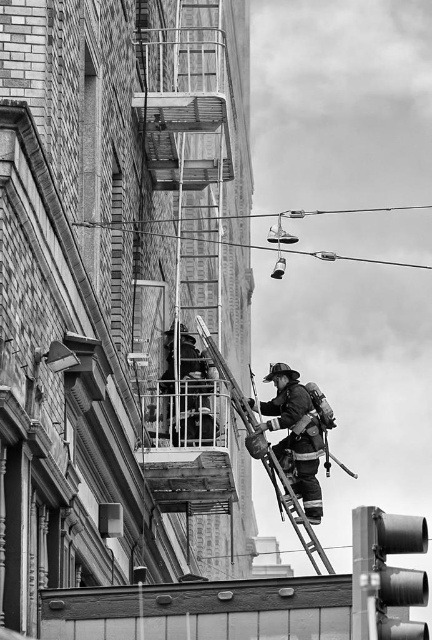
Is reflective silver helmet at center smaller than metallic silver ladder at center?

Yes.

Based on the photo, is reflective silver helmet at center behind metallic silver ladder at center?

Yes, reflective silver helmet at center is further from the viewer.

Between point (267, 376) and point (327, 561), which one is positioned behind?

Point (267, 376)

This screenshot has width=432, height=640. I want to click on reflective silver helmet at center, so click(x=298, y=433).

Is point (406, 604) closer to camera compared to point (384, 209)?

Yes.

This screenshot has width=432, height=640. What do you see at coordinates (400, 573) in the screenshot?
I see `metallic gray traffic light at lower right` at bounding box center [400, 573].

The image size is (432, 640). Find the location of `metallic gray traffic light at lower right`. metallic gray traffic light at lower right is located at coordinates (400, 573).

The height and width of the screenshot is (640, 432). What are the coordinates of `rustic metal fire escape at center` in the screenshot? It's located at (190, 234).

Which is behind, point (183, 508) or point (409, 205)?

Point (409, 205)

Image resolution: width=432 pixels, height=640 pixels. Find the location of `rustic metal fire escape at center`. rustic metal fire escape at center is located at coordinates (190, 234).